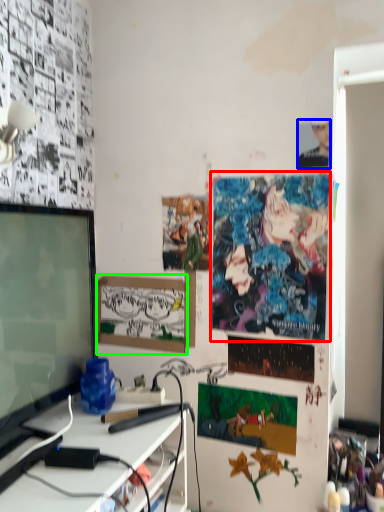
Question: Which is farther away from poster page (highlighted by a red box)? person (highlighted by a blue box) or picture frame (highlighted by a green box)?

Choices:
 (A) person
 (B) picture frame

Answer: (A)